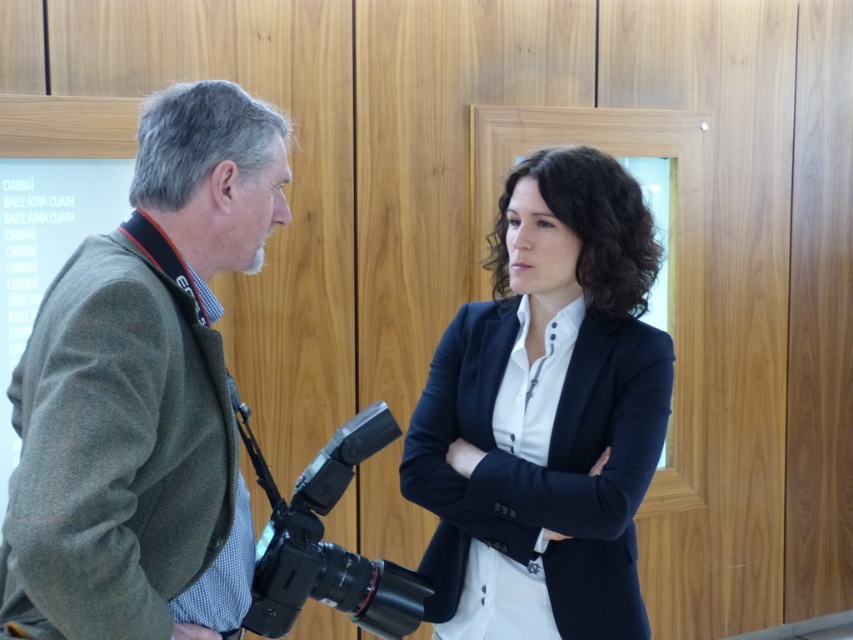
Question: Does green wool jacket at left have a greater width compared to navy blue blazer at center?

Choices:
 (A) no
 (B) yes

Answer: (A)

Question: Which point is farther to the camera?

Choices:
 (A) black plastic video camera at center
 (B) navy blue blazer at center
 (C) green wool jacket at left

Answer: (B)

Question: Is green wool jacket at left bigger than navy blue blazer at center?

Choices:
 (A) yes
 (B) no

Answer: (B)

Question: Observing the image, what is the correct spatial positioning of green wool jacket at left in reference to black plastic video camera at center?

Choices:
 (A) below
 (B) above

Answer: (B)

Question: Which of these objects is positioned closest to the navy blue blazer at center?

Choices:
 (A) black plastic video camera at center
 (B) green wool jacket at left

Answer: (A)

Question: Based on their relative distances, which object is farther from the green wool jacket at left?

Choices:
 (A) navy blue blazer at center
 (B) black plastic video camera at center

Answer: (A)